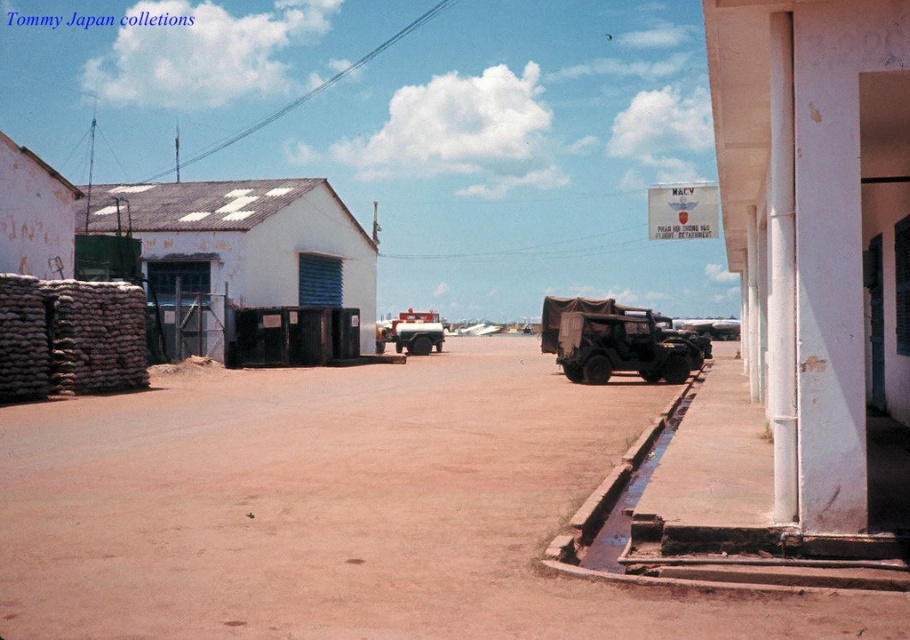
Consider the image. Does brown dirt track at center appear under matte red truck at center?

Indeed, brown dirt track at center is positioned under matte red truck at center.

Between brown dirt track at center and matte red truck at center, which one has more height?

With more height is matte red truck at center.

The width and height of the screenshot is (910, 640). What do you see at coordinates (346, 509) in the screenshot? I see `brown dirt track at center` at bounding box center [346, 509].

Where is `brown dirt track at center`? The width and height of the screenshot is (910, 640). brown dirt track at center is located at coordinates (346, 509).

Who is taller, brown dirt track at center or camouflage fabric jeep at center?

camouflage fabric jeep at center

Which is below, brown dirt track at center or camouflage fabric jeep at center?

brown dirt track at center

Locate an element on the screen. This screenshot has height=640, width=910. brown dirt track at center is located at coordinates (346, 509).

Locate an element on the screen. The height and width of the screenshot is (640, 910). brown dirt track at center is located at coordinates (346, 509).

Can you confirm if camouflage fabric jeep at center is thinner than matte red truck at center?

No, camouflage fabric jeep at center is not thinner than matte red truck at center.

Is camouflage fabric jeep at center shorter than matte red truck at center?

Yes, camouflage fabric jeep at center is shorter than matte red truck at center.

Which is in front, point (597, 378) or point (426, 328)?

Point (597, 378) is more forward.

Where is `camouflage fabric jeep at center`? This screenshot has height=640, width=910. camouflage fabric jeep at center is located at coordinates [x=613, y=340].